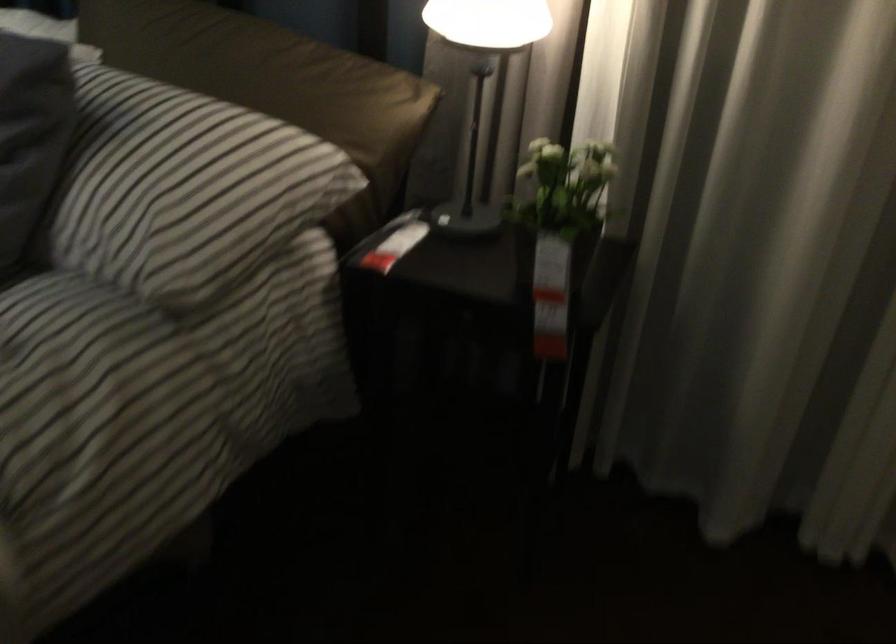
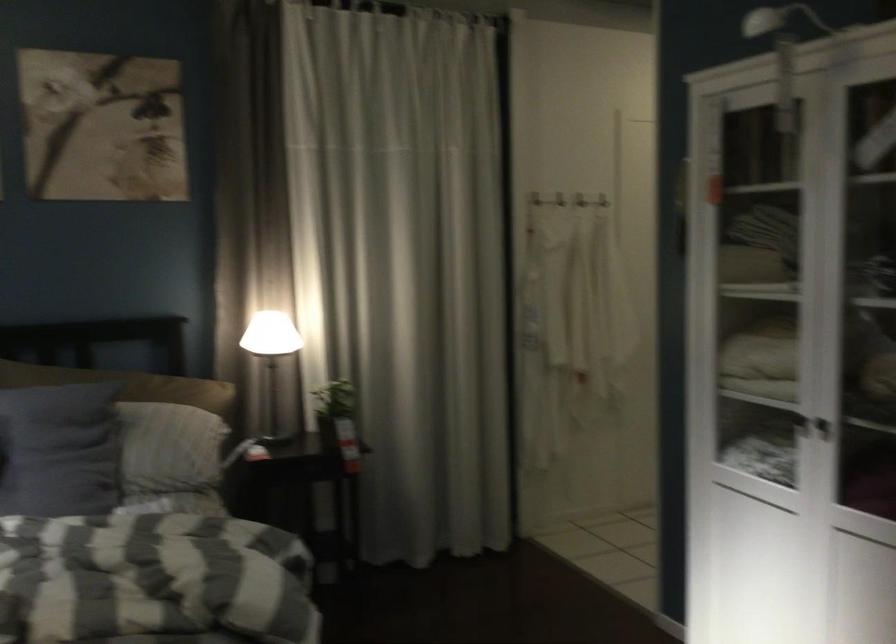
In the second image, find the point that corresponds to point 167,189 in the first image.

(173, 442)